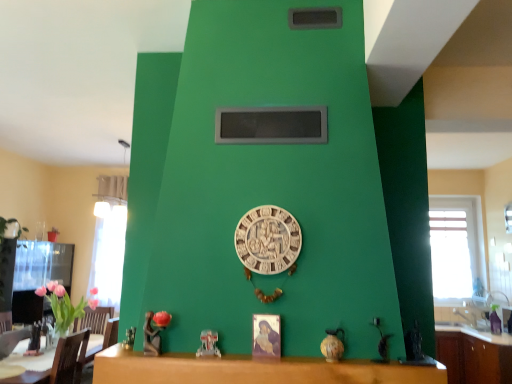
Question: Considering the relative sizes of brown leather armchair at lower left and transparent glass window at right, acting as the 1th window starting from the right, in the image provided, is brown leather armchair at lower left bigger than transparent glass window at right, acting as the 1th window starting from the right,?

Choices:
 (A) yes
 (B) no

Answer: (B)

Question: Is brown leather armchair at lower left thinner than transparent glass window at right, which is the 2th window from left to right?

Choices:
 (A) no
 (B) yes

Answer: (A)

Question: Is transparent glass window at right, which is the 2th window from left to right, completely or partially inside brown leather armchair at lower left?

Choices:
 (A) yes
 (B) no

Answer: (B)

Question: Is brown leather armchair at lower left closer to camera compared to transparent glass window at right, which is the 2th window from left to right?

Choices:
 (A) yes
 (B) no

Answer: (A)

Question: From the image's perspective, is brown leather armchair at lower left over transparent glass window at right, which is the 2th window from left to right?

Choices:
 (A) yes
 (B) no

Answer: (B)

Question: In terms of height, does transparent glass window at right, which is the 2th window from left to right, look taller or shorter compared to white carved clock at center?

Choices:
 (A) short
 (B) tall

Answer: (B)

Question: Considering their positions, is transparent glass window at right, which is the 2th window from left to right, located in front of or behind white carved clock at center?

Choices:
 (A) behind
 (B) front

Answer: (A)

Question: Based on their sizes in the image, would you say transparent glass window at right, acting as the 1th window starting from the right, is bigger or smaller than white carved clock at center?

Choices:
 (A) big
 (B) small

Answer: (A)

Question: Is transparent glass window at right, acting as the 1th window starting from the right, wider or thinner than white carved clock at center?

Choices:
 (A) thin
 (B) wide

Answer: (B)

Question: Is transparent glass window at right, which is the 2th window from left to right, in front of or behind brown leather armchair at lower left in the image?

Choices:
 (A) front
 (B) behind

Answer: (B)

Question: Is transparent glass window at right, which is the 2th window from left to right, wider or thinner than brown leather armchair at lower left?

Choices:
 (A) wide
 (B) thin

Answer: (B)

Question: From the image's perspective, relative to brown leather armchair at lower left, is transparent glass window at right, which is the 2th window from left to right, above or below?

Choices:
 (A) below
 (B) above

Answer: (B)

Question: Is transparent glass window at right, acting as the 1th window starting from the right, spatially inside brown leather armchair at lower left, or outside of it?

Choices:
 (A) inside
 (B) outside

Answer: (B)

Question: Is brown leather armchair at lower left wider or thinner than brown wood cabinet at lower right?

Choices:
 (A) wide
 (B) thin

Answer: (B)

Question: From the image's perspective, is brown leather armchair at lower left positioned above or below brown wood cabinet at lower right?

Choices:
 (A) above
 (B) below

Answer: (A)